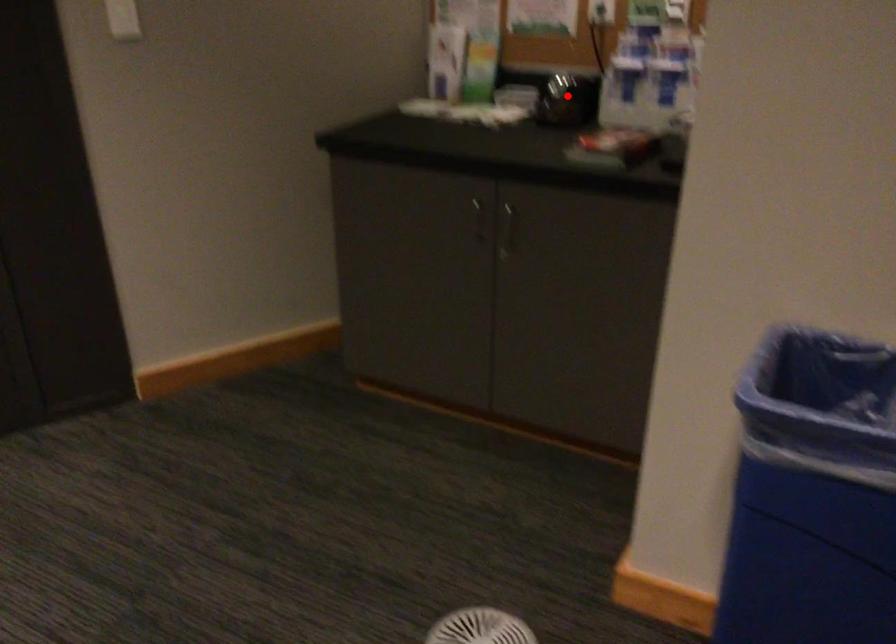
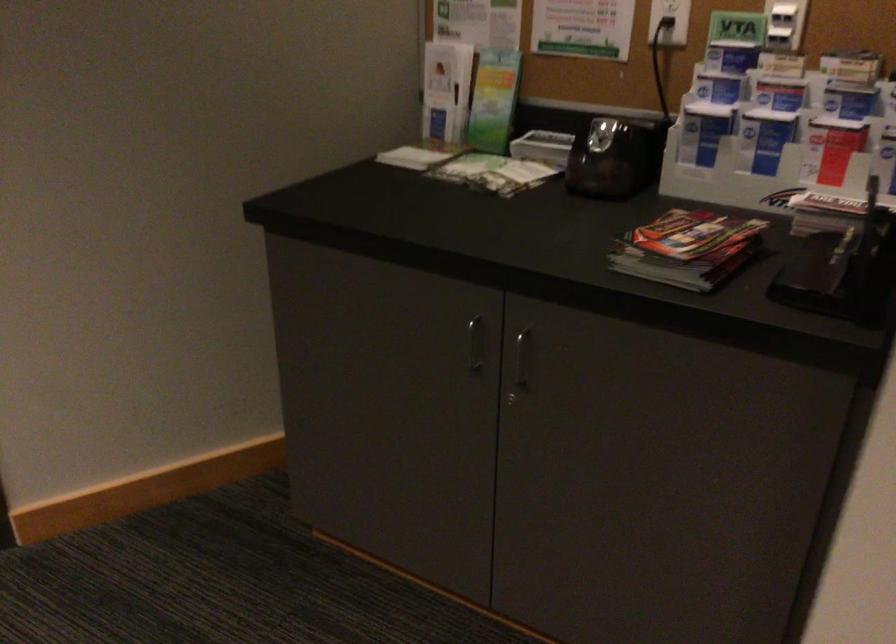
In the second image, find the point that corresponds to the highlighted location in the first image.

(613, 158)